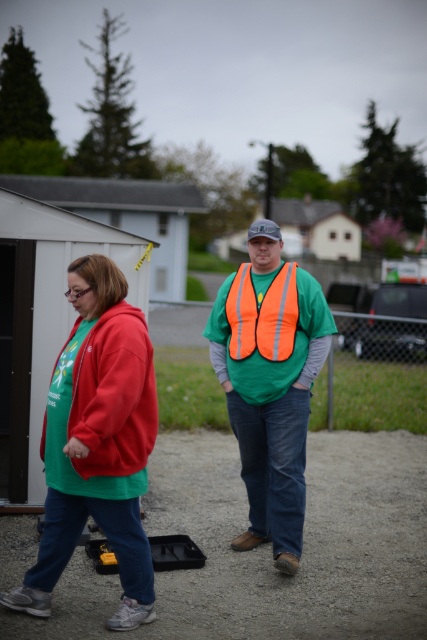
You are a fashion designer observing two people in an outdoor setting. You notice the matte fleece hoodie at left and the matte fleece jacket at left. Which clothing item is wider?

The matte fleece hoodie at left is wider than the matte fleece jacket at left according to the description provided.

You are planning to take a photo of the matte fleece jacket at left and the white plastic hut at upper left. Which object should you zoom in more on to capture details, considering their sizes in the image?

The matte fleece jacket at left is narrower than the white plastic hut at upper left, so you should zoom in more on the matte fleece jacket at left to capture its details since it is smaller in the image.

You are trying to locate the matte fleece jacket at left in the image. According to the coordinates provided, where exactly is it positioned?

The matte fleece jacket at left is located at point 0.617 on the x axis and 0.269 on the y axis.